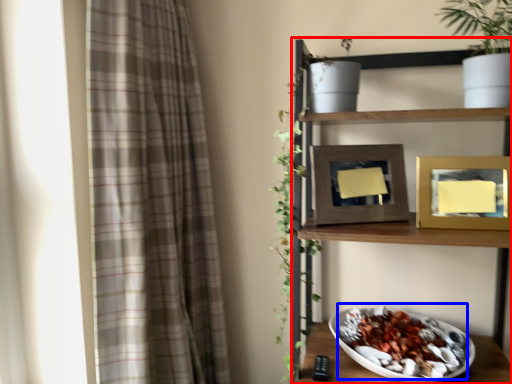
Question: Among these objects, which one is nearest to the camera, shelf (highlighted by a red box) or food (highlighted by a blue box)?

Choices:
 (A) shelf
 (B) food

Answer: (A)